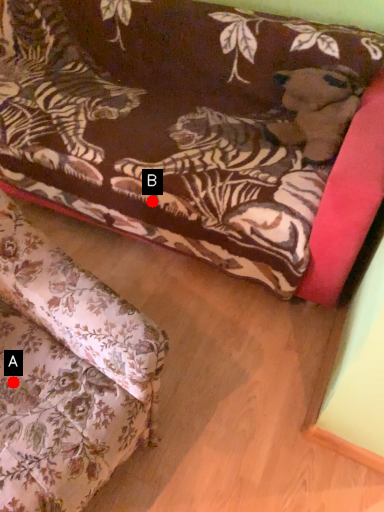
Question: Two points are circled on the image, labeled by A and B beside each circle. Which point is closer to the camera?

Choices:
 (A) A is closer
 (B) B is closer

Answer: (A)